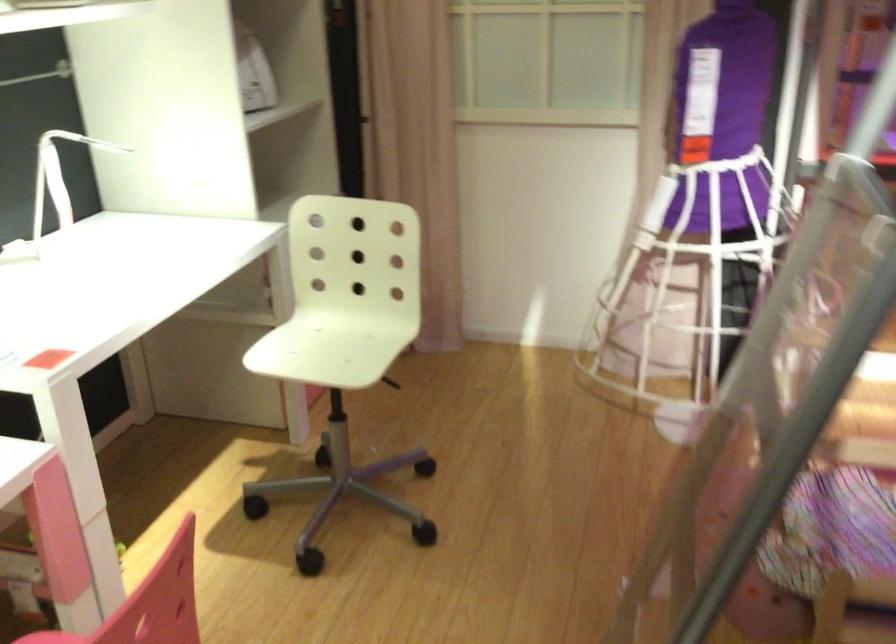
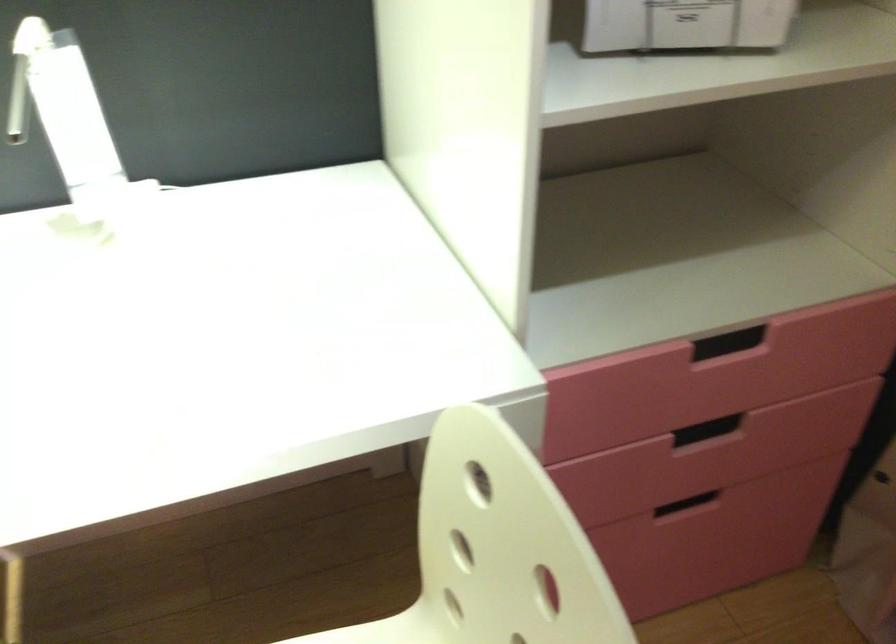
The point at (255, 100) is marked in the first image. Where is the corresponding point in the second image?

(685, 24)